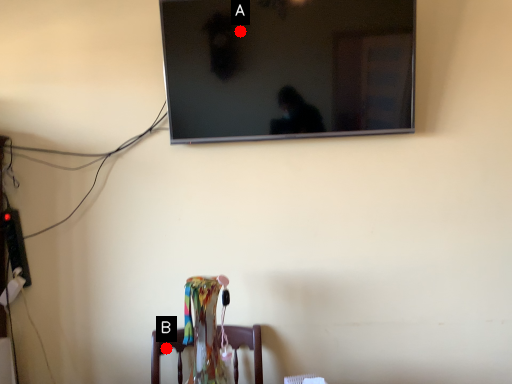
Question: Two points are circled on the image, labeled by A and B beside each circle. Which point is closer to the camera?

Choices:
 (A) A is closer
 (B) B is closer

Answer: (A)